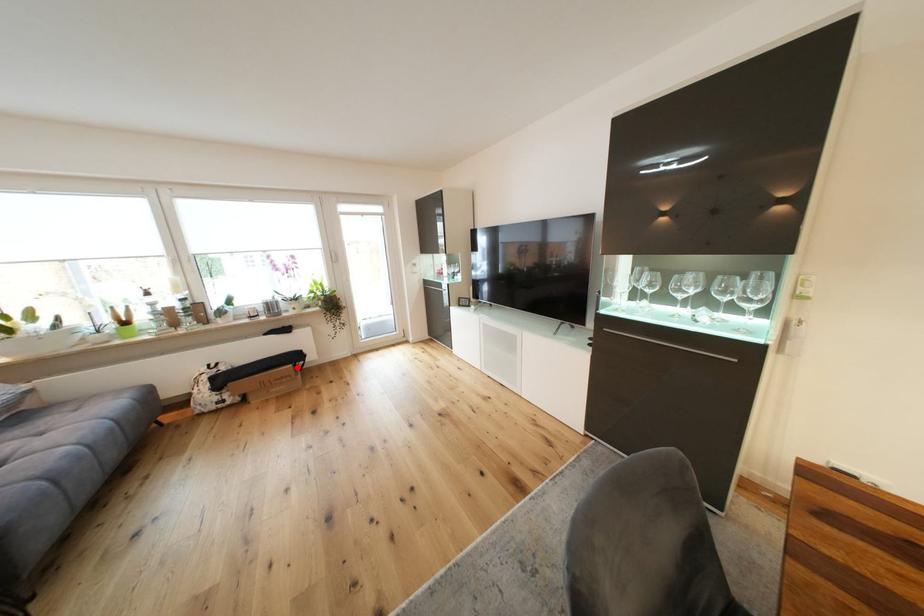
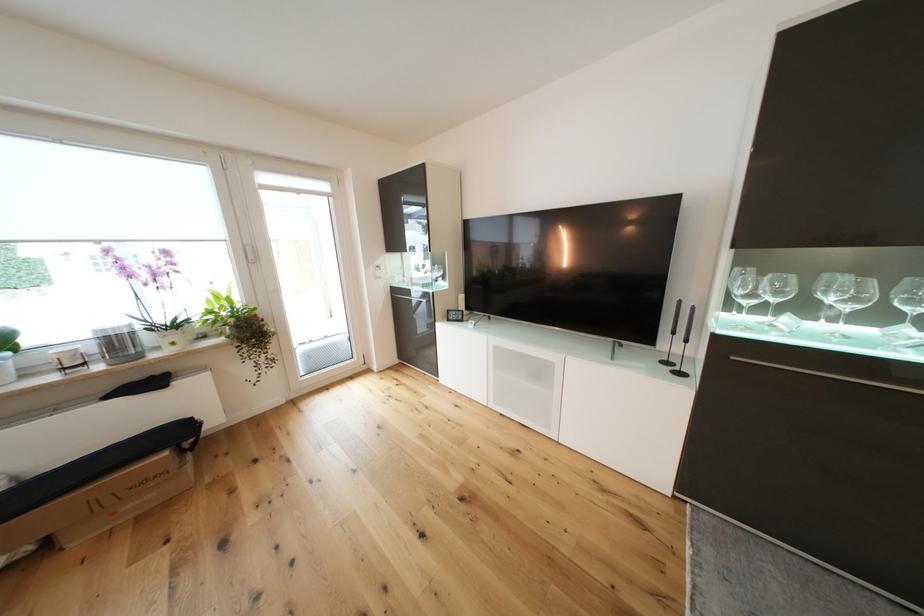
Question: I am providing you with two images of the same scene from different viewpoints. Given a red point in image1, look at the same physical point in image2. Is it:

Choices:
 (A) Closer to the viewpoint
 (B) Farther from the viewpoint

Answer: (B)